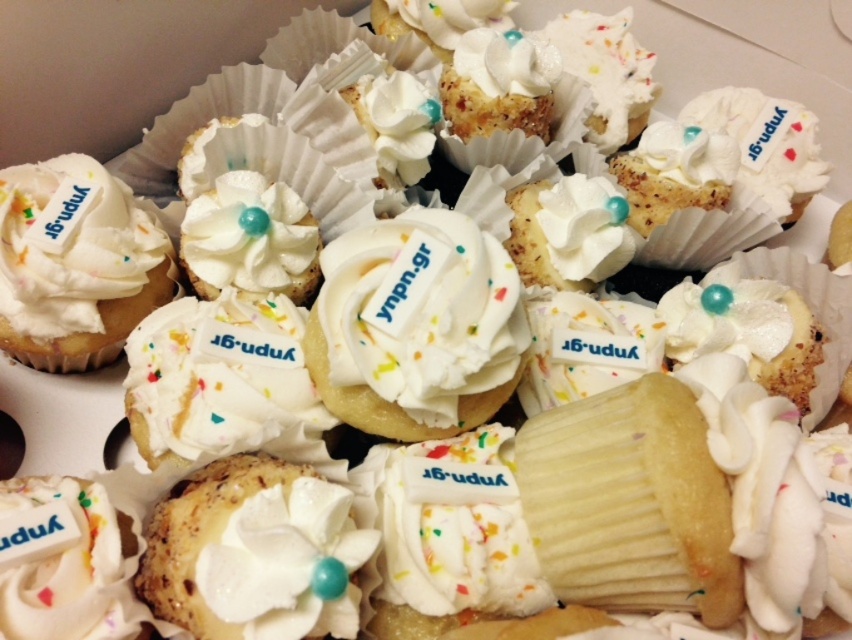
Question: Observing the image, what is the correct spatial positioning of white cream cupcake at center in reference to white matte cupcake at left?

Choices:
 (A) right
 (B) left

Answer: (A)

Question: Does white cream cupcake at center have a greater width compared to white matte cupcake at left?

Choices:
 (A) yes
 (B) no

Answer: (A)

Question: Is white cream cupcake at center closer to the viewer compared to white matte cupcake at left?

Choices:
 (A) no
 (B) yes

Answer: (B)